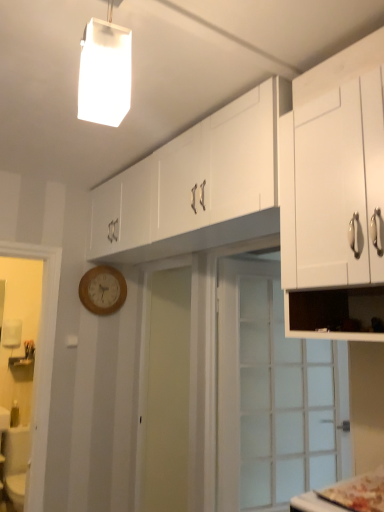
Question: Is white matte rectangular light fixture at upper center facing towards wooden clock at center-left?

Choices:
 (A) no
 (B) yes

Answer: (A)

Question: Can you confirm if white matte rectangular light fixture at upper center is bigger than wooden clock at center-left?

Choices:
 (A) no
 (B) yes

Answer: (A)

Question: Considering the relative positions of white matte rectangular light fixture at upper center and wooden clock at center-left in the image provided, is white matte rectangular light fixture at upper center behind wooden clock at center-left?

Choices:
 (A) yes
 (B) no

Answer: (B)

Question: Does white matte rectangular light fixture at upper center have a greater height compared to wooden clock at center-left?

Choices:
 (A) yes
 (B) no

Answer: (A)

Question: Can you confirm if white matte rectangular light fixture at upper center is positioned to the right of wooden clock at center-left?

Choices:
 (A) yes
 (B) no

Answer: (A)

Question: From the image's perspective, is wooden clock at center-left positioned above or below clear glass door at center?

Choices:
 (A) above
 (B) below

Answer: (A)

Question: From their relative heights in the image, would you say wooden clock at center-left is taller or shorter than clear glass door at center?

Choices:
 (A) short
 (B) tall

Answer: (A)

Question: Would you say wooden clock at center-left is to the left or to the right of clear glass door at center in the picture?

Choices:
 (A) right
 (B) left

Answer: (B)

Question: Considering the positions of wooden clock at center-left and clear glass door at center in the image, is wooden clock at center-left wider or thinner than clear glass door at center?

Choices:
 (A) thin
 (B) wide

Answer: (A)

Question: Looking at the image, does clear glass door at center seem bigger or smaller compared to wooden clock at center-left?

Choices:
 (A) big
 (B) small

Answer: (A)

Question: From a real-world perspective, is clear glass door at center positioned above or below wooden clock at center-left?

Choices:
 (A) below
 (B) above

Answer: (A)

Question: From the image's perspective, is clear glass door at center positioned above or below wooden clock at center-left?

Choices:
 (A) above
 (B) below

Answer: (B)

Question: In terms of width, does clear glass door at center look wider or thinner when compared to wooden clock at center-left?

Choices:
 (A) wide
 (B) thin

Answer: (A)

Question: Considering the relative positions of white matte cabinet at upper right, arranged as the 1th cabinetry when viewed from the front, and white glossy cabinet at upper center, the 1th cabinetry from the back, in the image provided, is white matte cabinet at upper right, arranged as the 1th cabinetry when viewed from the front, to the left or to the right of white glossy cabinet at upper center, the 1th cabinetry from the back,?

Choices:
 (A) right
 (B) left

Answer: (A)

Question: Is white matte cabinet at upper right, arranged as the 1th cabinetry when viewed from the front, wider or thinner than white glossy cabinet at upper center, the 1th cabinetry from the back?

Choices:
 (A) thin
 (B) wide

Answer: (A)